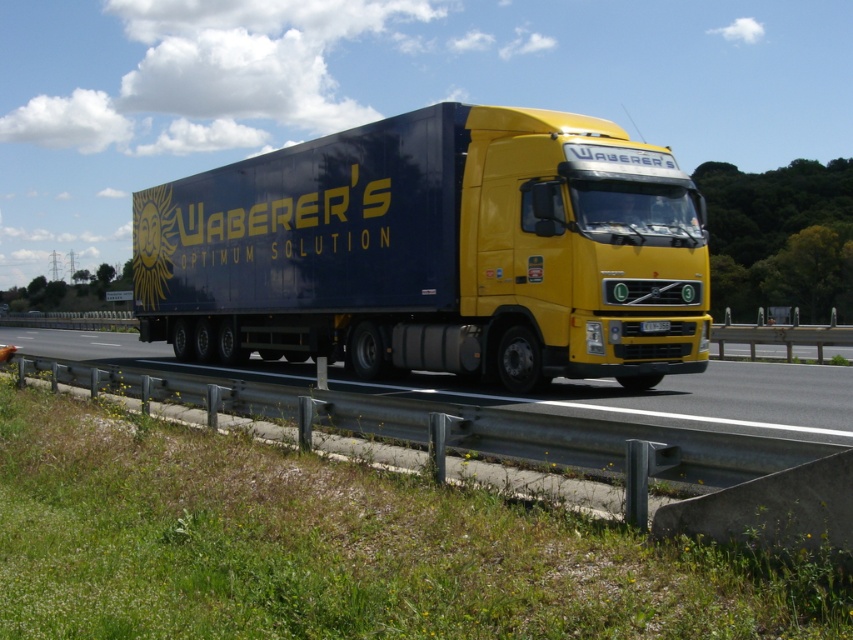
You are a delivery driver who needs to pass under a low bridge ahead. You see the matte black trailer truck at center and the metallic gray highway at lower center in your rearview mirror. Which object indicates the height restriction you must consider?

The matte black trailer truck at center is much taller than the metallic gray highway at lower center, so the height of the matte black trailer truck at center must be considered for passing under the bridge.

Looking at this image, you are a drone operator tasked with capturing aerial footage of the matte black trailer truck at center and the metallic gray highway at lower center. Your drone has a maximum flight range of 10 feet. Can the drone safely capture footage of both objects without exceeding its range?

The distance between the matte black trailer truck at center and the metallic gray highway at lower center is 8.36 feet, which is within the drone operator drone maximum flight range of 10 feet. Therefore, the drone can safely capture footage of both objects without exceeding its range.